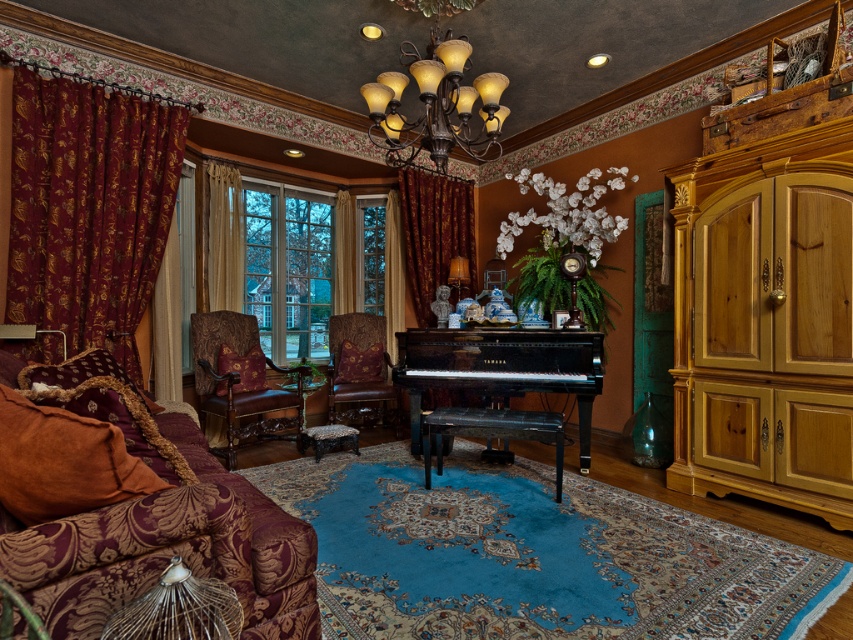
You are an interior designer planning to install a new lighting fixture in the room. The current bronze textured chandelier at upper center and the beige fabric curtain at center are in your line of sight. Which object is bigger in size?

The bronze textured chandelier at upper center is larger in size compared to the beige fabric curtain at center.

You are planning to place a new lamp on the black polished piano at center. However, you notice the velvet curtain at center might block the light. Is the lamp likely to receive sufficient light from above?

The black polished piano at center is positioned under the velvet curtain at center, so the curtain might block some light. The lamp may not receive sufficient light from above.

Looking at this image, you are planning to hang a large painting that requires a wide space. Based on the scene, which curtain between the beige fabric curtain at center and the velvet burgundy curtain at left would you choose to place the painting next to, and why?

The beige fabric curtain at center has a larger size compared to the velvet burgundy curtain at left, so you should place the painting next to the beige fabric curtain at center as it provides more space.